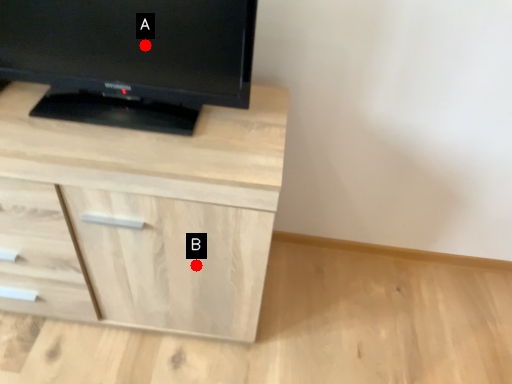
Question: Two points are circled on the image, labeled by A and B beside each circle. Which point is closer to the camera taking this photo?

Choices:
 (A) A is closer
 (B) B is closer

Answer: (A)